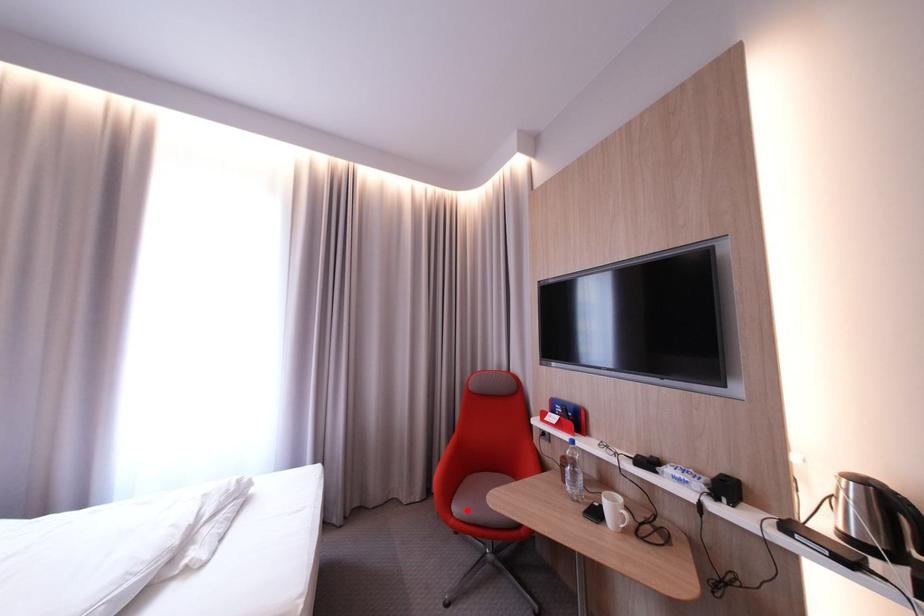
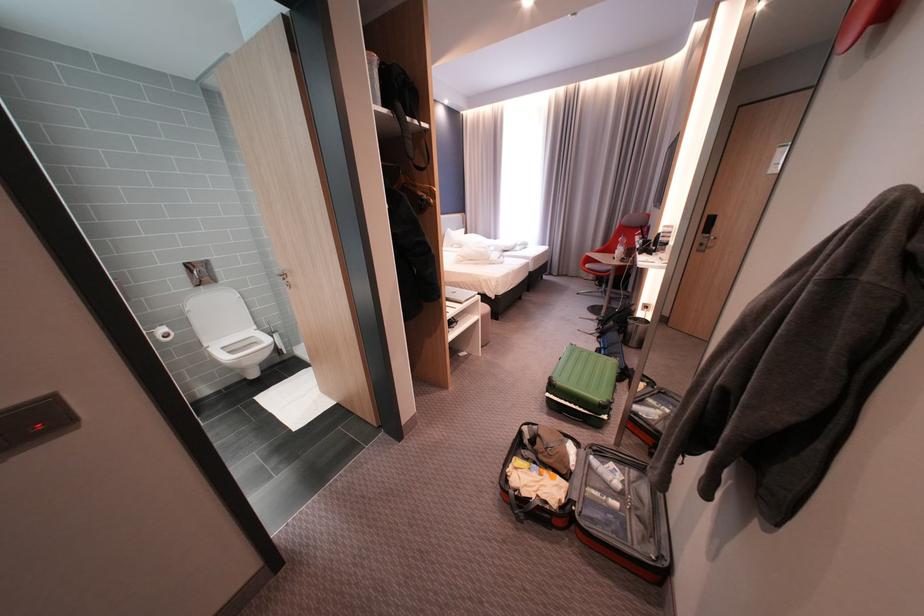
Question: I am providing you with two images of the same scene from different viewpoints. Given a red point in image1, look at the same physical point in image2. Is it:

Choices:
 (A) Closer to the viewpoint
 (B) Farther from the viewpoint

Answer: (A)